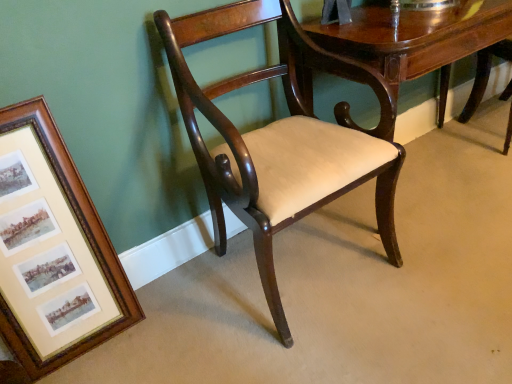
Identify the location of mahogany wood chair at center. (282, 139).

The image size is (512, 384). What do you see at coordinates (417, 38) in the screenshot?
I see `mahogany wood table at center` at bounding box center [417, 38].

The height and width of the screenshot is (384, 512). What are the coordinates of `wooden framed prints at left` in the screenshot? It's located at (81, 239).

You are a GUI agent. You are given a task and a screenshot of the screen. Output one action in this format:
    pyautogui.click(x=<x>, y=<y>)
    Task: Click on the mahogany wood chair at center
    The height and width of the screenshot is (384, 512).
    Given the screenshot: What is the action you would take?
    pyautogui.click(x=282, y=139)

Is wooden framed prints at left not near mahogany wood table at center?

Yes.

From a real-world perspective, is wooden framed prints at left physically above mahogany wood table at center?

Yes, from a real-world perspective, wooden framed prints at left is above mahogany wood table at center.

Could you tell me if wooden framed prints at left is turned towards mahogany wood table at center?

No, wooden framed prints at left is not facing towards mahogany wood table at center.

Looking at their sizes, would you say wooden framed prints at left is wider or thinner than mahogany wood table at center?

wooden framed prints at left is thinner than mahogany wood table at center.

Does wooden framed prints at left have a lesser width compared to mahogany wood chair at center?

Indeed, wooden framed prints at left has a lesser width compared to mahogany wood chair at center.

Based on the photo, from a real-world perspective, is wooden framed prints at left over mahogany wood chair at center?

No, from a real-world perspective, wooden framed prints at left is not over mahogany wood chair at center

I want to click on picture frame that appears below the mahogany wood chair at center (from the image's perspective), so click(81, 239).

Is wooden framed prints at left inside or outside of mahogany wood chair at center?

wooden framed prints at left cannot be found inside mahogany wood chair at center.

Could you tell me if mahogany wood table at center is turned towards mahogany wood chair at center?

No, mahogany wood table at center is not facing towards mahogany wood chair at center.

What's the angular difference between mahogany wood table at center and mahogany wood chair at center's facing directions?

0.777 degrees separate the facing orientations of mahogany wood table at center and mahogany wood chair at center.

Consider the image. Which object is thinner, mahogany wood table at center or mahogany wood chair at center?

mahogany wood table at center.

Between mahogany wood table at center and mahogany wood chair at center, which one appears on the right side from the viewer's perspective?

mahogany wood table at center.

From a real-world perspective, is mahogany wood chair at center over mahogany wood table at center?

Yes, from a real-world perspective, mahogany wood chair at center is above mahogany wood table at center.

Is point (390, 256) positioned in front of point (382, 48)?

That is False.

The height and width of the screenshot is (384, 512). What are the coordinates of `table behind the mahogany wood chair at center` in the screenshot? It's located at (417, 38).

Could you tell me if mahogany wood chair at center is facing mahogany wood table at center?

No.

Which is in front, point (318, 156) or point (79, 214)?

Point (318, 156)

Is wooden framed prints at left surrounded by mahogany wood chair at center?

No, wooden framed prints at left is located outside of mahogany wood chair at center.

Can you confirm if mahogany wood chair at center is thinner than wooden framed prints at left?

No.

Could you tell me if mahogany wood table at center is facing wooden framed prints at left?

No.

The height and width of the screenshot is (384, 512). What are the coordinates of `picture frame below the mahogany wood table at center (from the image's perspective)` in the screenshot? It's located at (81, 239).

In terms of width, does mahogany wood table at center look wider or thinner when compared to wooden framed prints at left?

In the image, mahogany wood table at center appears to be wider than wooden framed prints at left.

From the image's perspective, is mahogany wood table at center over wooden framed prints at left?

Indeed, from the image's perspective, mahogany wood table at center is shown above wooden framed prints at left.

This screenshot has height=384, width=512. I want to click on table behind the wooden framed prints at left, so click(417, 38).

At what (x,y) coordinates should I click in order to perform the action: click on chair lying on the right of wooden framed prints at left. Please return your answer as a coordinate pair (x, y). Looking at the image, I should click on (282, 139).

When comparing their distances from wooden framed prints at left, does mahogany wood chair at center or mahogany wood table at center seem closer?

Based on the image, mahogany wood chair at center appears to be nearer to wooden framed prints at left.

Estimate the real-world distances between objects in this image. Which object is further from mahogany wood chair at center, wooden framed prints at left or mahogany wood table at center?

wooden framed prints at left.

Considering their positions, is mahogany wood chair at center positioned closer to mahogany wood table at center than wooden framed prints at left?

mahogany wood chair at center.

From the image, which object appears to be farther from wooden framed prints at left, mahogany wood table at center or mahogany wood chair at center?

mahogany wood table at center is positioned further to the anchor wooden framed prints at left.

Considering their positions, is wooden framed prints at left positioned closer to mahogany wood table at center than mahogany wood chair at center?

Among the two, mahogany wood chair at center is located nearer to mahogany wood table at center.

Based on their spatial positions, is mahogany wood table at center or wooden framed prints at left further from mahogany wood chair at center?

Among the two, wooden framed prints at left is located further to mahogany wood chair at center.

The height and width of the screenshot is (384, 512). I want to click on chair located between wooden framed prints at left and mahogany wood table at center in the left-right direction, so click(x=282, y=139).